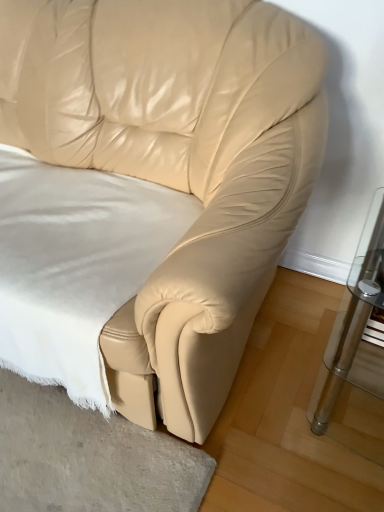
Question: Are white soft fabric at center and clear glass table at right making contact?

Choices:
 (A) yes
 (B) no

Answer: (B)

Question: Is white soft fabric at center far from clear glass table at right?

Choices:
 (A) no
 (B) yes

Answer: (A)

Question: From a real-world perspective, is white soft fabric at center beneath clear glass table at right?

Choices:
 (A) no
 (B) yes

Answer: (A)

Question: Is white soft fabric at center at the left side of clear glass table at right?

Choices:
 (A) no
 (B) yes

Answer: (B)

Question: Is white soft fabric at center wider than clear glass table at right?

Choices:
 (A) no
 (B) yes

Answer: (B)

Question: Could you tell me if white soft fabric at center is facing clear glass table at right?

Choices:
 (A) yes
 (B) no

Answer: (B)

Question: Is clear glass table at right facing away from white soft fabric at center?

Choices:
 (A) yes
 (B) no

Answer: (B)

Question: Can you confirm if clear glass table at right is wider than white soft fabric at center?

Choices:
 (A) no
 (B) yes

Answer: (A)

Question: Considering the relative sizes of clear glass table at right and white soft fabric at center in the image provided, is clear glass table at right shorter than white soft fabric at center?

Choices:
 (A) yes
 (B) no

Answer: (B)

Question: Does clear glass table at right have a larger size compared to white soft fabric at center?

Choices:
 (A) yes
 (B) no

Answer: (B)

Question: Is clear glass table at right aimed at white soft fabric at center?

Choices:
 (A) no
 (B) yes

Answer: (A)

Question: Is white soft fabric at center located within clear glass table at right?

Choices:
 (A) no
 (B) yes

Answer: (A)

Question: From the image's perspective, relative to clear glass table at right, is white soft fabric at center above or below?

Choices:
 (A) below
 (B) above

Answer: (B)